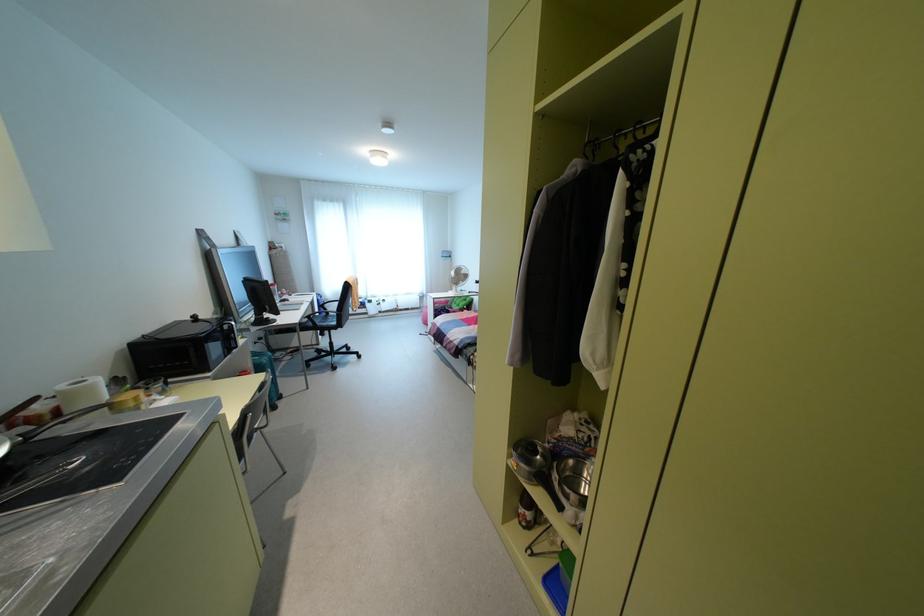
Where is `small metal pot`? small metal pot is located at coordinates (529, 459).